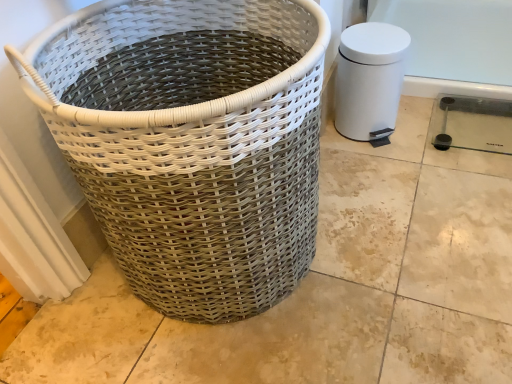
This screenshot has width=512, height=384. What are the coordinates of `vacant space to the right of white matte water heater at right` in the screenshot? It's located at (417, 123).